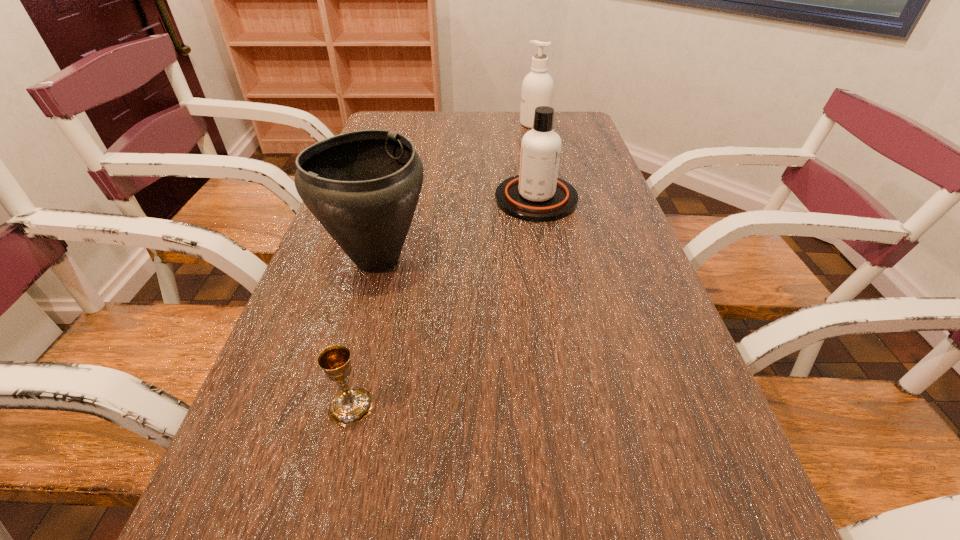
This screenshot has width=960, height=540. Find the location of `free region located 0.150m on the front of the chalice`. free region located 0.150m on the front of the chalice is located at coordinates (321, 530).

Find the location of `object present at the far edge`. object present at the far edge is located at coordinates (537, 88).

Locate an element on the screen. This screenshot has height=540, width=960. urn that is at the left edge is located at coordinates (363, 187).

The height and width of the screenshot is (540, 960). In order to click on chalice at the left edge in this screenshot , I will do `click(350, 406)`.

Where is `object present at the far right corner`? This screenshot has width=960, height=540. object present at the far right corner is located at coordinates (537, 88).

Where is `free location at the far edge`? free location at the far edge is located at coordinates (517, 119).

In the image, there is a desktop. Where is `blank space at the left edge`? The height and width of the screenshot is (540, 960). blank space at the left edge is located at coordinates (283, 353).

This screenshot has height=540, width=960. In the image, there is a desktop. Identify the location of vacant region at the right edge. point(653,306).

Where is `unoccupied position between the third farthest object and the farther cleansing agent`? The height and width of the screenshot is (540, 960). unoccupied position between the third farthest object and the farther cleansing agent is located at coordinates (456, 192).

Identify the location of blank region between the farther cleansing agent and the shortest object. (443, 265).